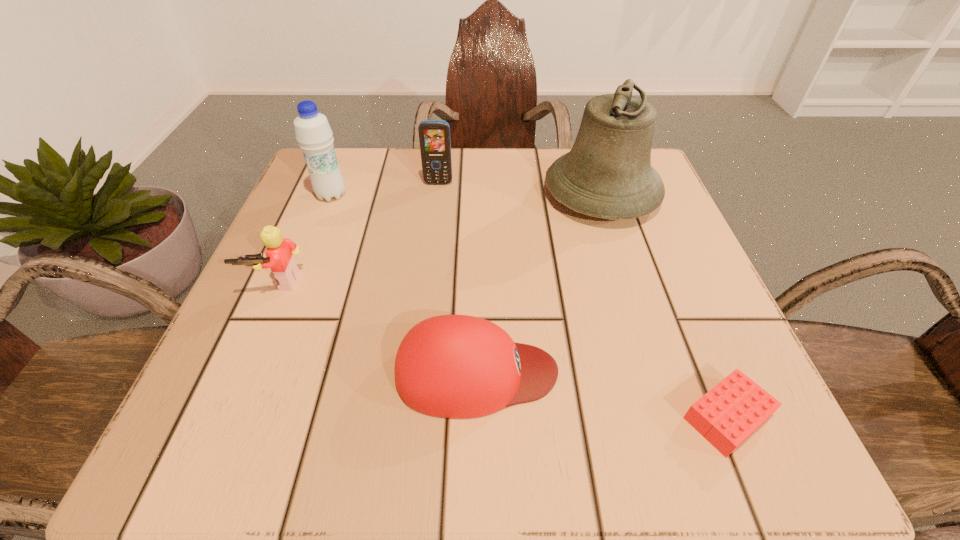
This screenshot has width=960, height=540. What are the coordinates of `bell` in the screenshot? It's located at (607, 174).

I want to click on water bottle, so click(313, 133).

Where is `cellular telephone`? This screenshot has width=960, height=540. cellular telephone is located at coordinates (434, 135).

Identify the location of the farther Lego. The image size is (960, 540). (279, 258).

Image resolution: width=960 pixels, height=540 pixels. I want to click on the left Lego, so click(279, 258).

This screenshot has height=540, width=960. In order to click on the fifth tallest object in this screenshot , I will do `click(452, 366)`.

I want to click on the right Lego, so click(730, 412).

Where is `the shortest object`? Image resolution: width=960 pixels, height=540 pixels. the shortest object is located at coordinates (730, 412).

Locate an element on the screen. Image resolution: width=960 pixels, height=540 pixels. vacant point located on the front of the bell is located at coordinates (620, 253).

Where is `free space located on the front of the water bottle`? This screenshot has height=540, width=960. free space located on the front of the water bottle is located at coordinates (307, 256).